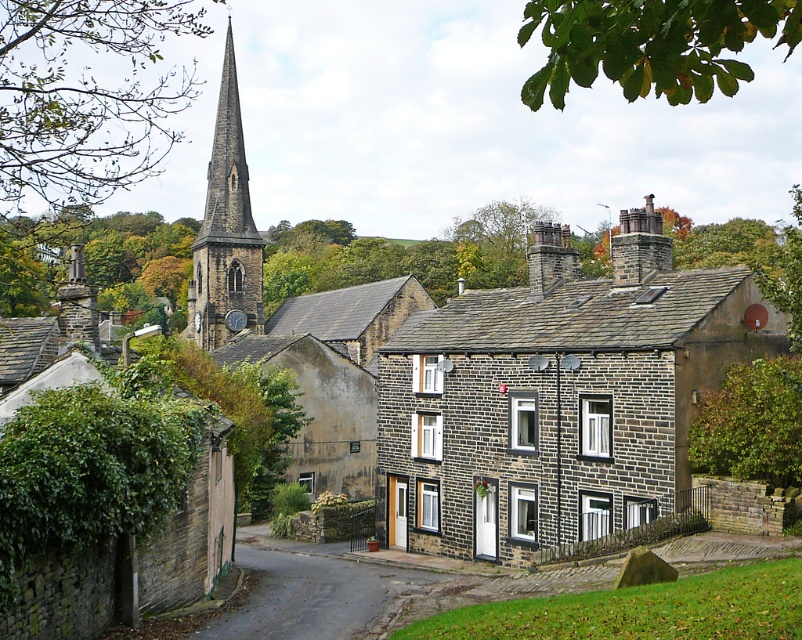
How far apart are dark gray stone steeple at upper left and dark gray stone chimney at upper right?

dark gray stone steeple at upper left and dark gray stone chimney at upper right are 84.88 meters apart.

Does dark gray stone steeple at upper left appear on the left side of dark gray stone chimney at upper right?

Yes, dark gray stone steeple at upper left is to the left of dark gray stone chimney at upper right.

Locate an element on the screen. This screenshot has height=640, width=802. dark gray stone steeple at upper left is located at coordinates (225, 230).

Does brown stone house at center appear over dark gray stone chimney at upper right?

Actually, brown stone house at center is below dark gray stone chimney at upper right.

What do you see at coordinates (555, 408) in the screenshot? I see `brown stone house at center` at bounding box center [555, 408].

Where is `brown stone house at center`? The width and height of the screenshot is (802, 640). brown stone house at center is located at coordinates point(555,408).

Does green leafy branch at upper center appear under dark gray stone steeple at upper left?

Actually, green leafy branch at upper center is above dark gray stone steeple at upper left.

Consider the image. Does green leafy branch at upper center come behind dark gray stone steeple at upper left?

No, green leafy branch at upper center is in front of dark gray stone steeple at upper left.

I want to click on green leafy branch at upper center, so click(x=651, y=44).

At what (x,y) coordinates should I click in order to perform the action: click on green leafy branch at upper center. Please return your answer as a coordinate pair (x, y). Looking at the image, I should click on (651, 44).